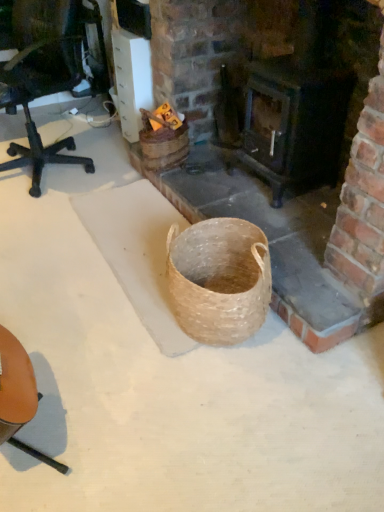
This screenshot has width=384, height=512. I want to click on vacant space underneath brown leather chair at lower left (from a real-world perspective), so click(x=36, y=436).